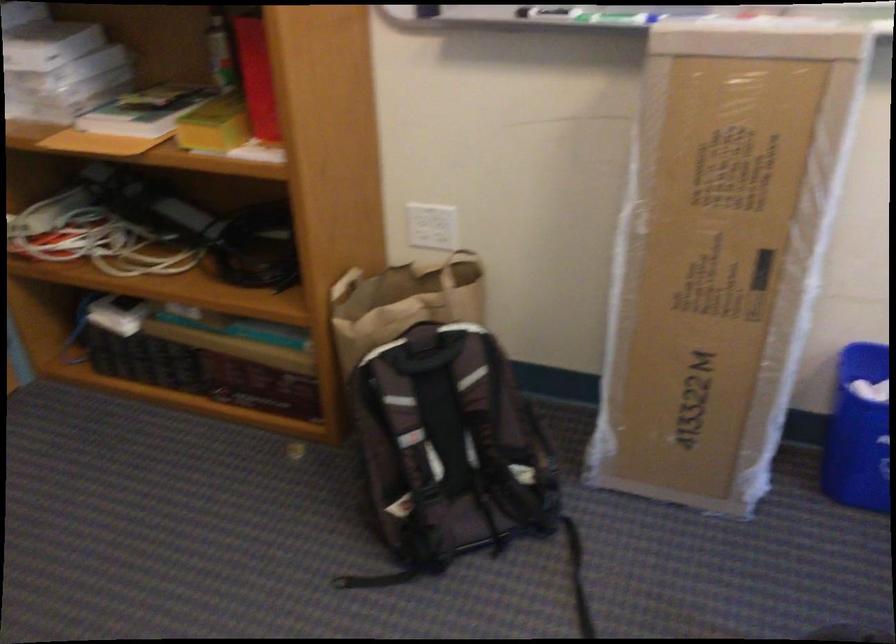
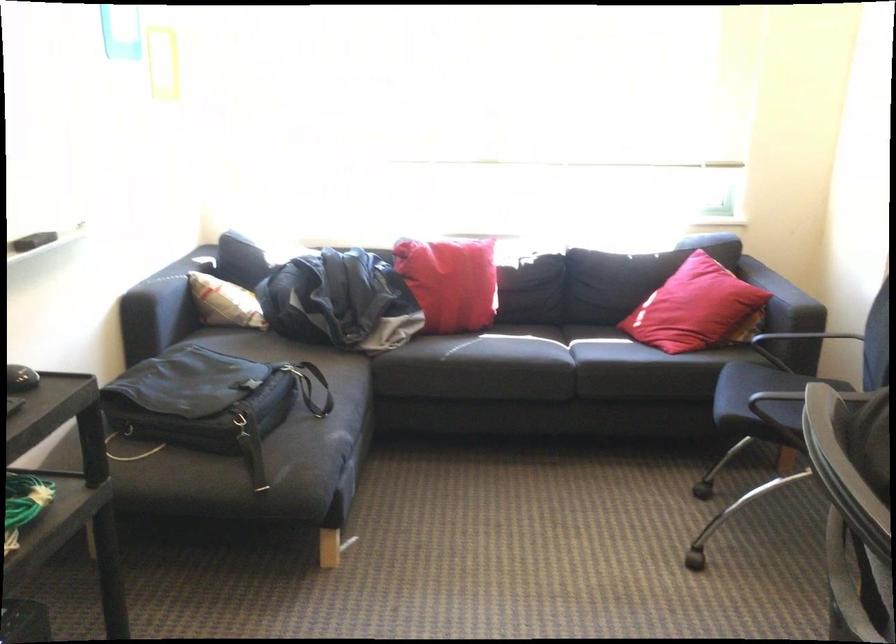
The images are taken continuously from a first-person perspective. In which direction is your viewpoint rotating?

The camera rotated toward right-down.